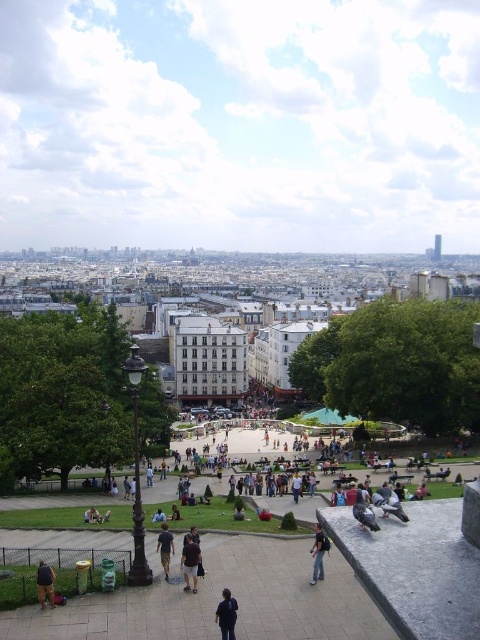
You are a photographer trying to capture a photo of the dark blue fabric at lower center and the brown leather jacket at lower left in the same frame. Since you want both objects to be clearly visible, which object should you focus on to ensure the larger one is in sharp focus?

The dark blue fabric at lower center is larger than the brown leather jacket at lower left, so you should focus on the dark blue fabric at lower center to ensure it is in sharp focus.

You are standing on the plaza and see a person wearing jeans at lower center and dark brown leather jacket at center. Which clothing item is located to the right?

The jeans at lower center is positioned on the right side of dark brown leather jacket at center.

You are standing at the edge of the plaza in the cityscape image. You want to take a photo of the jeans at lower center. Where should you position yourself to capture the jeans in the lower center of your camera frame?

To capture the jeans at lower center in the lower center of your camera frame, position yourself so that the jeans at lower center aligns with the lower center point of your viewfinder or screen, which corresponds to the coordinate point [319,554] in the image.